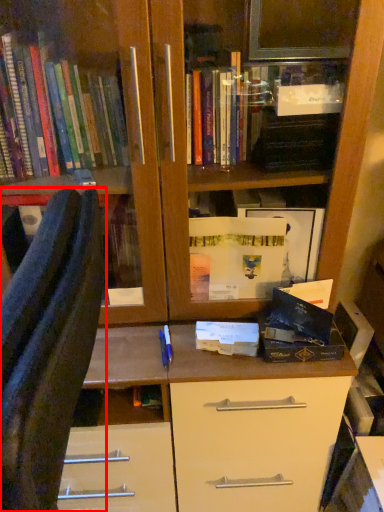
Question: From the image, what is the correct spatial relationship of furniture (annotated by the red box) in relation to paperback book?

Choices:
 (A) right
 (B) left

Answer: (B)